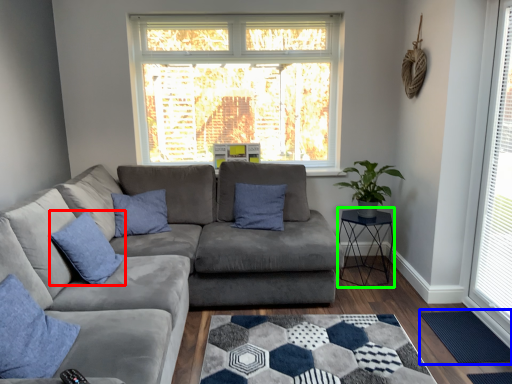
Question: Which is nearer to the pillow (highlighted by a red box)? mat (highlighted by a blue box) or cocktail table (highlighted by a green box).

Choices:
 (A) mat
 (B) cocktail table

Answer: (B)